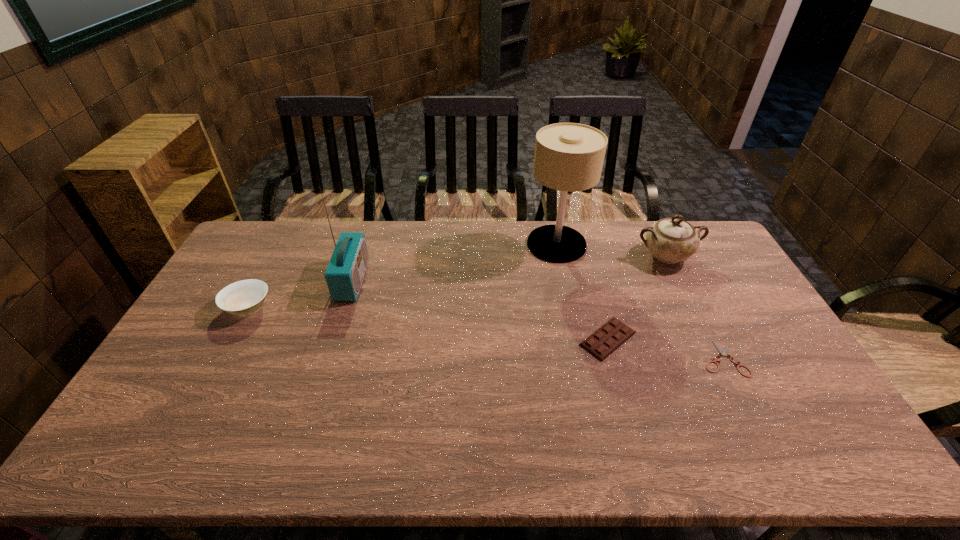
Find the location of `object positioned at the far right corner`. object positioned at the far right corner is located at coordinates (671, 240).

Identify the location of free space at the far edge. (325, 240).

I want to click on free location at the near edge, so click(735, 434).

I want to click on free point at the right edge, so click(772, 328).

The height and width of the screenshot is (540, 960). In order to click on vacant space at the near left corner in this screenshot , I will do 175,448.

Locate an element on the screen. The width and height of the screenshot is (960, 540). vacant space that's between the tallest object and the fourth tallest object is located at coordinates click(x=402, y=276).

The height and width of the screenshot is (540, 960). I want to click on free space between the second tallest object and the shears, so click(538, 319).

The image size is (960, 540). I want to click on vacant point located between the fifth tallest object and the shears, so click(665, 349).

Where is `free point between the leftmost object and the shortest object`? This screenshot has width=960, height=540. free point between the leftmost object and the shortest object is located at coordinates (486, 333).

This screenshot has width=960, height=540. Identify the location of free spot between the fifth object from right to left and the tallest object. (454, 262).